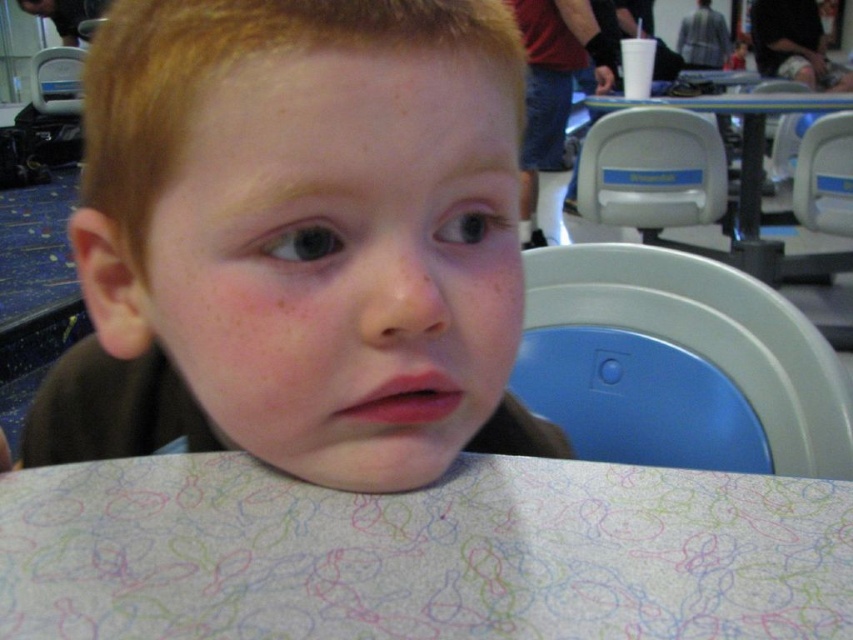
Looking at this image, does smooth skin child at center have a lesser width compared to white plastic table at center?

Correct, smooth skin child at center's width is less than white plastic table at center's.

The height and width of the screenshot is (640, 853). What do you see at coordinates (299, 240) in the screenshot?
I see `smooth skin child at center` at bounding box center [299, 240].

Find the location of a particular element. smooth skin child at center is located at coordinates [299, 240].

Which is in front, point (282, 4) or point (137, 461)?

Point (282, 4) is more forward.

Does smooth skin child at center have a lesser height compared to white paper at center?

No.

I want to click on smooth skin child at center, so click(299, 240).

Between white paper at center and white plastic table at center, which one is positioned higher?

white plastic table at center is higher up.

Between white paper at center and white plastic table at center, which one has more height?

Standing taller between the two is white plastic table at center.

This screenshot has height=640, width=853. In order to click on white paper at center in this screenshot , I will do `click(421, 554)`.